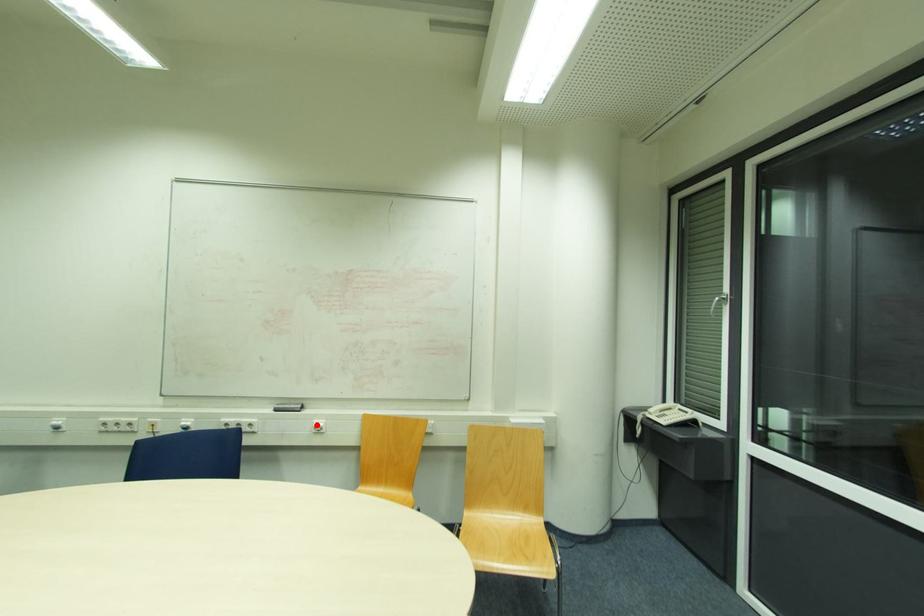
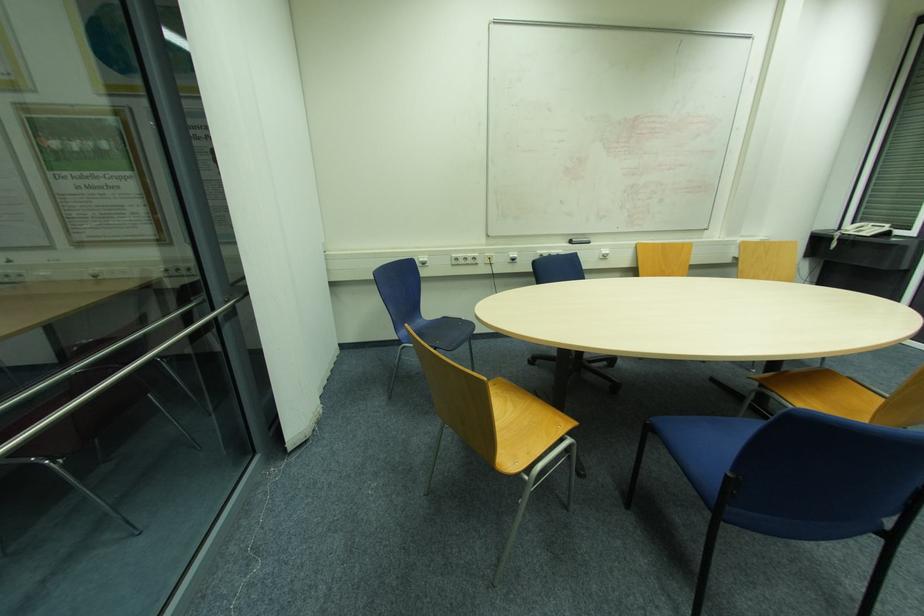
Question: I am providing you with two images of the same scene from different viewpoints. Image1 has a red point marked. In image2, the corresponding 3D location appears at what relative position? Reply with the corresponding letter.

Choices:
 (A) Closer
 (B) Farther

Answer: (A)